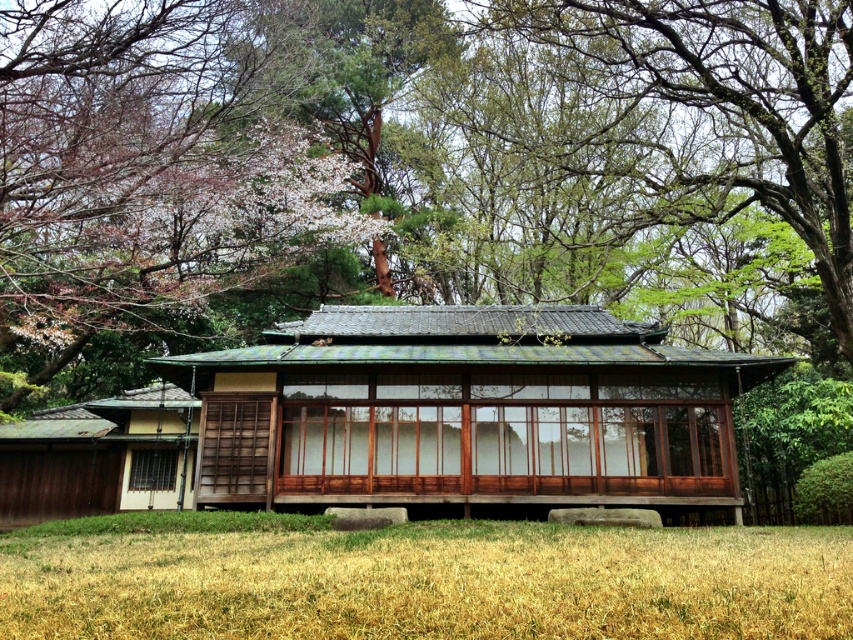
You are standing in front of the traditional Japanese house and notice the green leafy tree at upper center and the dry grass at lower center. Which object is located to the right of the other?

The green leafy tree at upper center is positioned on the right side of dry grass at lower center.

You are standing in front of the traditional Japanese house and want to take a photo of both the green leafy tree at upper center and the wooden gazebo at center. Which object will appear larger in the photo?

The green leafy tree at upper center will appear larger in the photo because it is much taller than the wooden gazebo at center.

You are standing at point (396, 316) and want to walk towards the house. Is point (169, 285) located behind you or in front of you relative to your direction of movement?

Point (169, 285) is behind point (396, 316), so when you are facing the house and moving towards it, point (169, 285) would be behind you relative to your direction of movement.